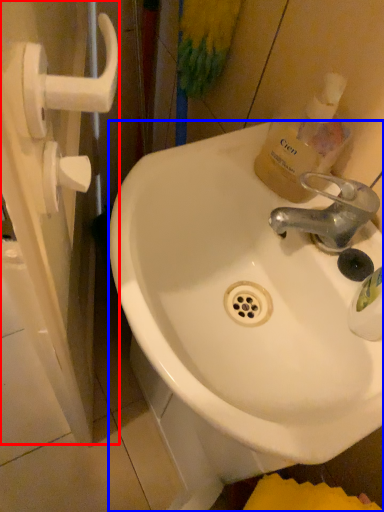
Question: Which of the following is the farthest to the observer, screen door (highlighted by a red box) or sink (highlighted by a blue box)?

Choices:
 (A) screen door
 (B) sink

Answer: (B)